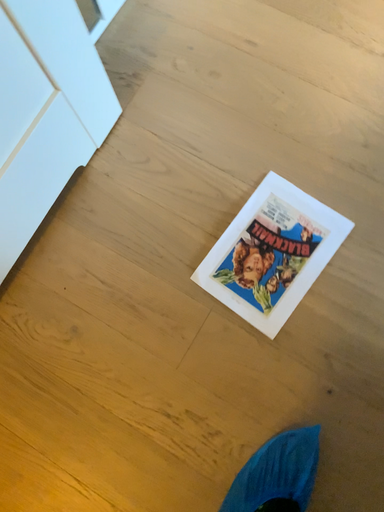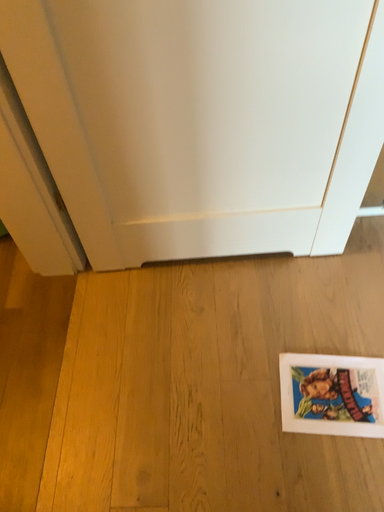
Question: Which way did the camera rotate in the video?

Choices:
 (A) rotated downward
 (B) rotated upward

Answer: (B)